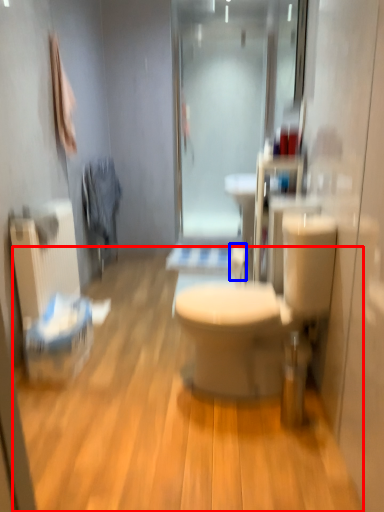
Question: Which point is closer to the camera, plain (highlighted by a red box) or toilet paper (highlighted by a blue box)?

Choices:
 (A) plain
 (B) toilet paper

Answer: (A)